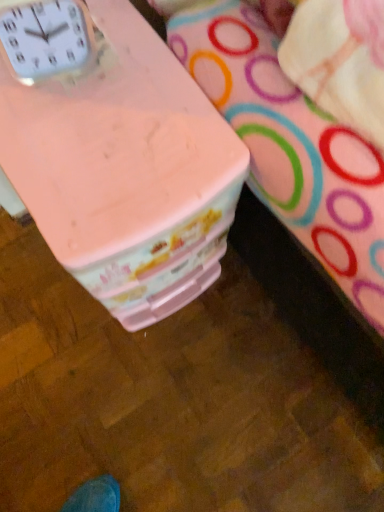
Locate an element on the screen. The height and width of the screenshot is (512, 384). free spot to the left of pink plastic container at center is located at coordinates (34, 288).